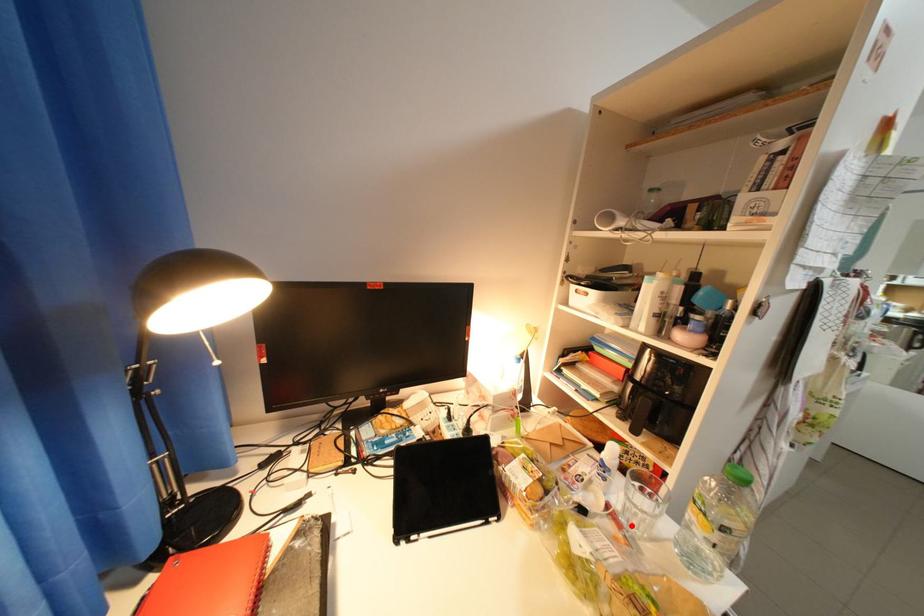
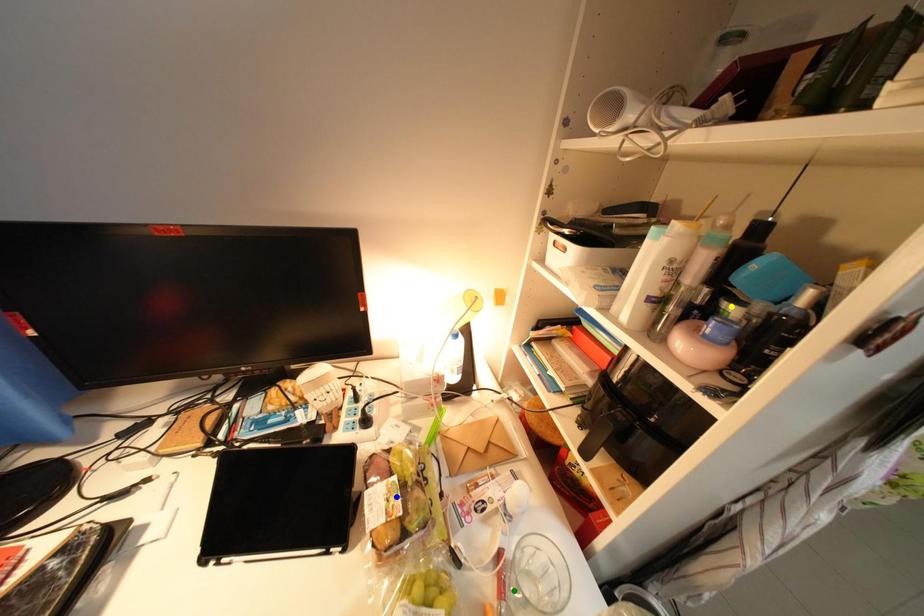
Question: I am providing you with two images of the same scene from different viewpoints. A red point is marked on the first image. You are given multiple points on the second image. Which point in image 2 represents the same 3d spot as the red point in image 1?

Choices:
 (A) blue point
 (B) yellow point
 (C) green point

Answer: (C)